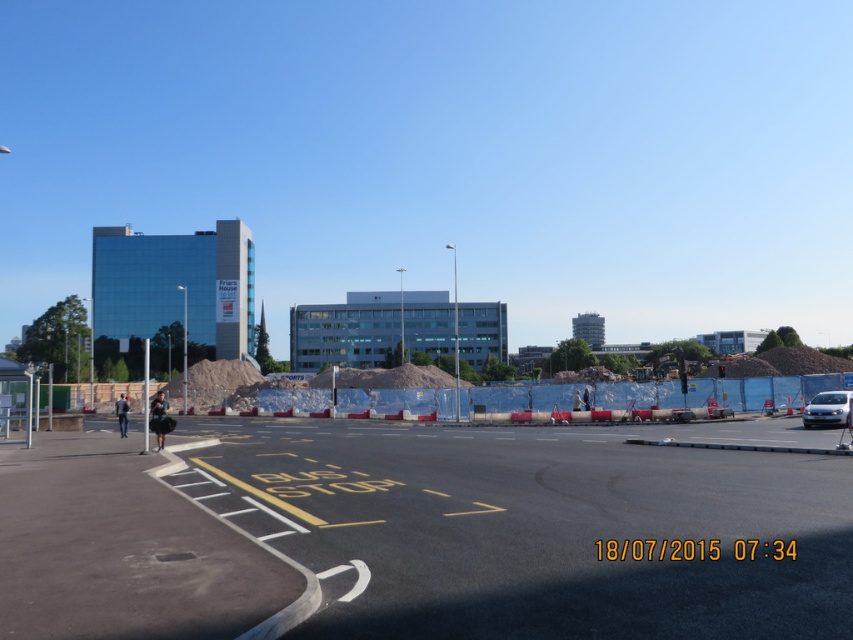
Question: Which of the following is the farthest from the observer?

Choices:
 (A) satin silver car at right
 (B) blue plastic barrier at center

Answer: (B)

Question: Which object is closer to the camera taking this photo?

Choices:
 (A) blue plastic barrier at center
 (B) black asphalt at center

Answer: (B)

Question: Is blue plastic barrier at center above satin silver car at right?

Choices:
 (A) no
 (B) yes

Answer: (A)

Question: Does blue plastic barrier at center come in front of satin silver car at right?

Choices:
 (A) yes
 (B) no

Answer: (B)

Question: Among these points, which one is nearest to the camera?

Choices:
 (A) (804, 419)
 (B) (738, 388)

Answer: (A)

Question: Does black asphalt at center lie in front of satin silver car at right?

Choices:
 (A) yes
 (B) no

Answer: (A)